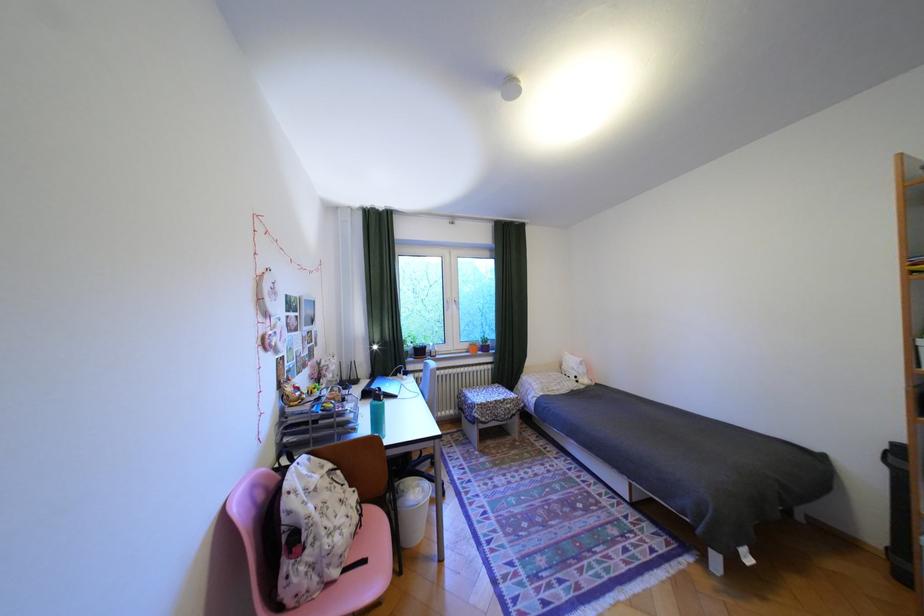
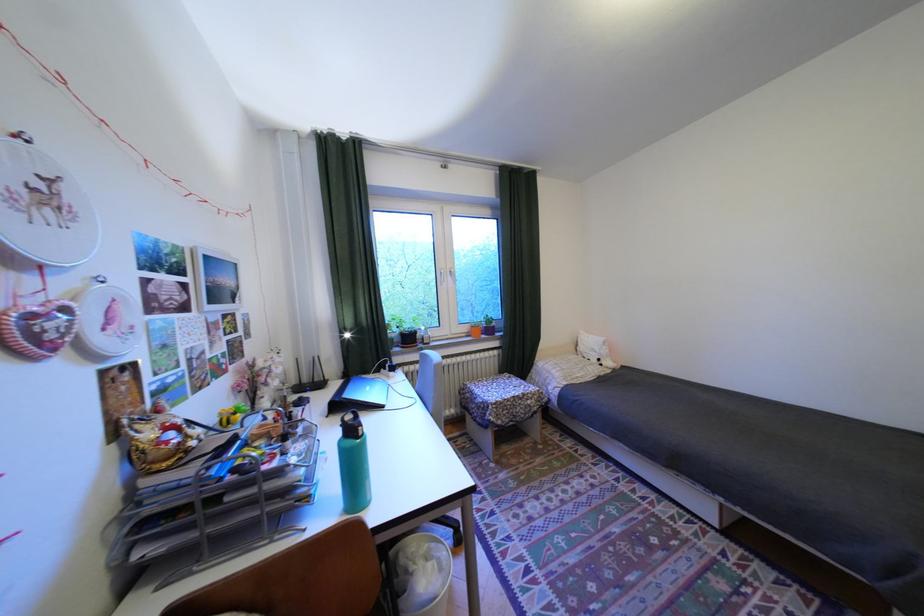
Locate, in the second image, the point that corresponds to pixel 429 490 in the first image.

(442, 565)